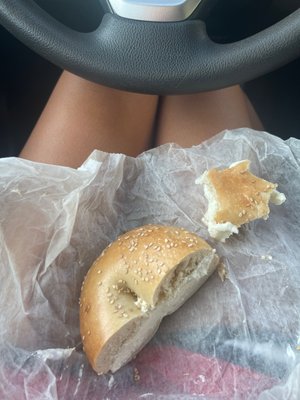
Locate an element on the screen. The height and width of the screenshot is (400, 300). floor is located at coordinates (274, 90).